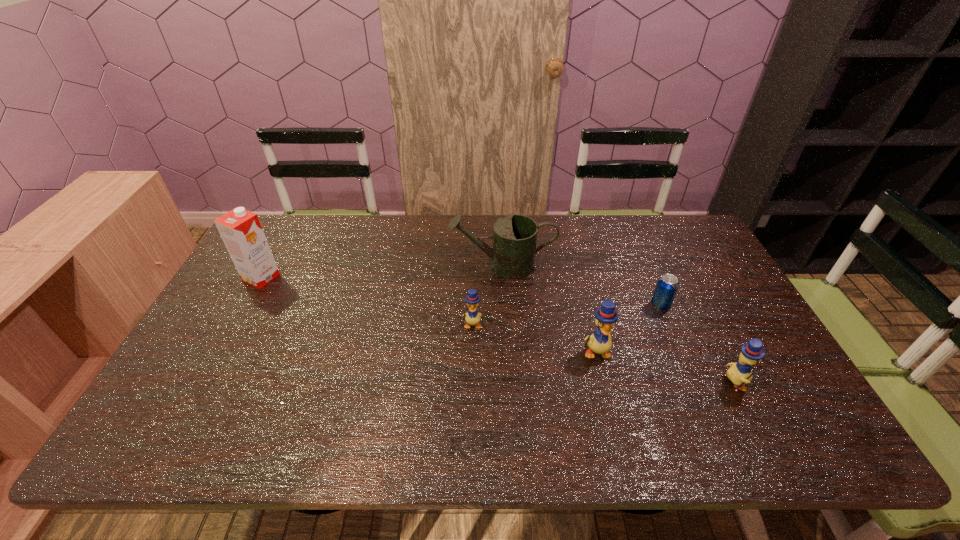
Identify the location of watering can. The width and height of the screenshot is (960, 540). (514, 236).

The width and height of the screenshot is (960, 540). I want to click on blank space located 0.210m on the face of the third nearest object, where the monocle is placed, so click(470, 397).

The image size is (960, 540). I want to click on free space located on the face of the second nearest object, where the monocle is placed, so click(x=606, y=392).

The image size is (960, 540). Identify the location of free region located 0.060m on the face of the rightmost object, where the monocle is placed. (771, 383).

The image size is (960, 540). Find the location of `free space located on the left of the shortest object`. free space located on the left of the shortest object is located at coordinates (627, 306).

Where is `vacant position located on the right of the leftmost object`? vacant position located on the right of the leftmost object is located at coordinates (377, 278).

The height and width of the screenshot is (540, 960). I want to click on vacant area located with the spout on the watering can, so click(369, 266).

Where is `free space located 0.160m with the spout on the watering can`? Image resolution: width=960 pixels, height=540 pixels. free space located 0.160m with the spout on the watering can is located at coordinates point(399,266).

Image resolution: width=960 pixels, height=540 pixels. I want to click on vacant position located with the spout on the watering can, so click(369, 266).

Locate an element on the screen. Image resolution: width=960 pixels, height=540 pixels. object present at the far edge is located at coordinates (514, 236).